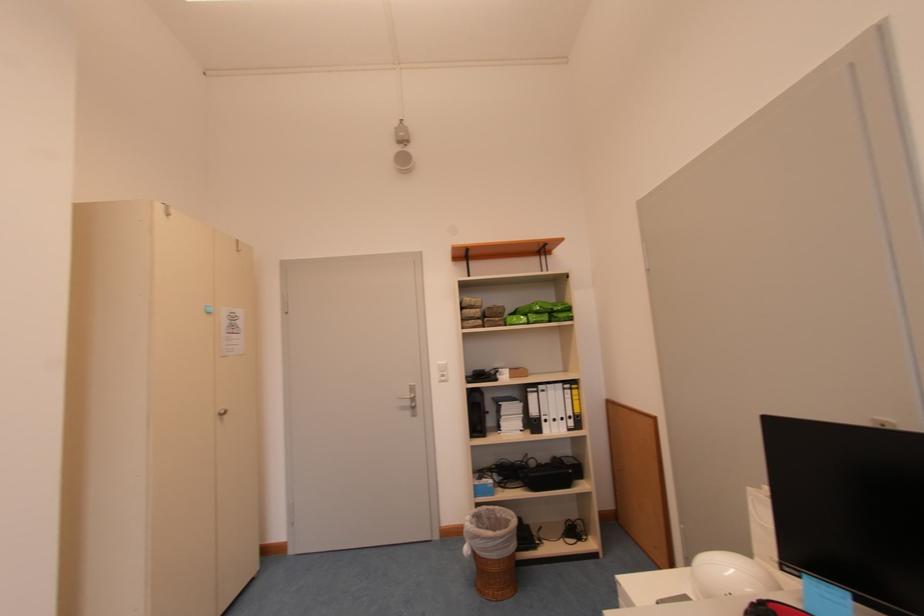
What are the coordinates of `metal door handle` in the screenshot? It's located at (410, 397).